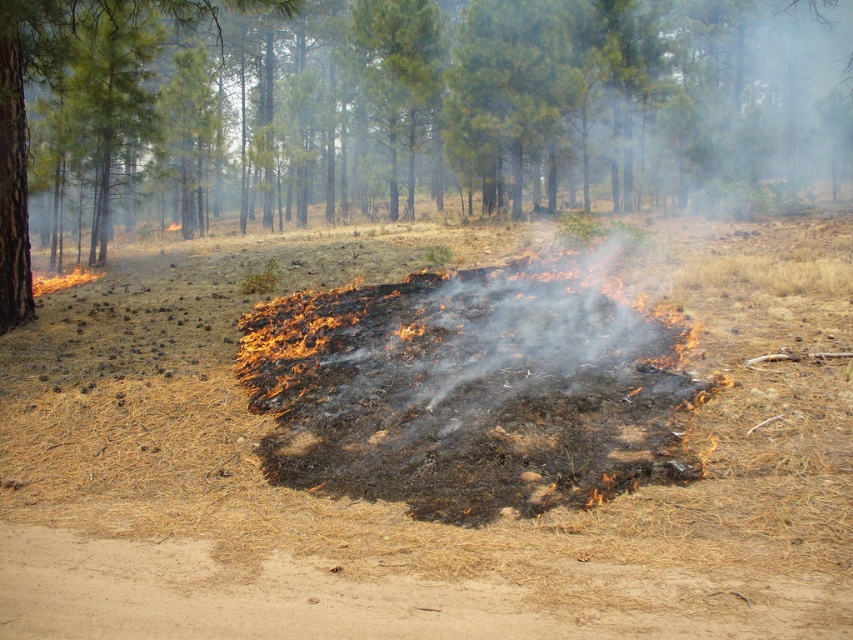
Is the position of charcoal ash at center less distant than that of green leafy tree at center?

Yes, it is in front of green leafy tree at center.

Who is more forward, (148, 515) or (720, 49)?

Point (148, 515) is in front.

This screenshot has height=640, width=853. I want to click on charcoal ash at center, so click(399, 500).